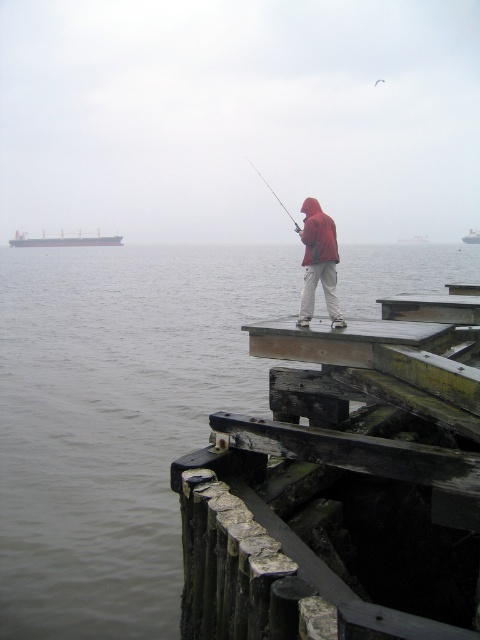
Can you confirm if matte red jacket at center is positioned above metallic gray ship at center?

Incorrect, matte red jacket at center is not positioned above metallic gray ship at center.

Does matte red jacket at center come behind metallic gray ship at center?

That is False.

Which is behind, point (331, 257) or point (408, 241)?

Positioned behind is point (408, 241).

You are a GUI agent. You are given a task and a screenshot of the screen. Output one action in this format:
    pyautogui.click(x=<x>, y=<y>)
    Task: Click on the matte red jacket at center
    The image size is (480, 640).
    Given the screenshot: What is the action you would take?
    pyautogui.click(x=319, y=262)

Is point (55, 516) positioned behind point (14, 243)?

No, (55, 516) is closer to viewer.

Which of these two, gray water at center or gray matte cargo ship at left, stands shorter?

gray matte cargo ship at left

Describe the element at coordinates (116, 419) in the screenshot. I see `gray water at center` at that location.

Where is `gray water at center`? This screenshot has width=480, height=640. gray water at center is located at coordinates (116, 419).

Is gray matte cargo ship at left to the right of metallic gray ship at upper left from the viewer's perspective?

No, gray matte cargo ship at left is not to the right of metallic gray ship at upper left.

Does point (64, 237) come in front of point (468, 236)?

Yes, point (64, 237) is in front of point (468, 236).

Which is in front, point (98, 241) or point (464, 241)?

Point (98, 241)

Where is `gray matte cargo ship at left`? The height and width of the screenshot is (640, 480). gray matte cargo ship at left is located at coordinates (x=64, y=240).